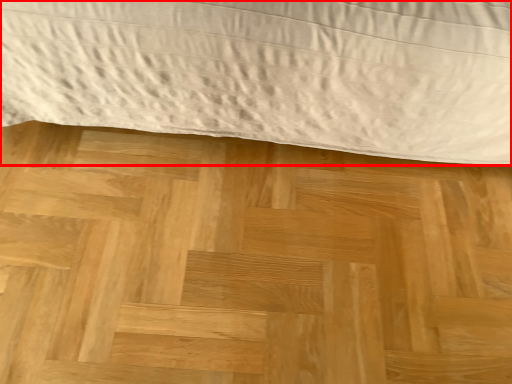
Question: In this image, where is bed (annotated by the red box) located relative to plywood?

Choices:
 (A) left
 (B) right

Answer: (B)